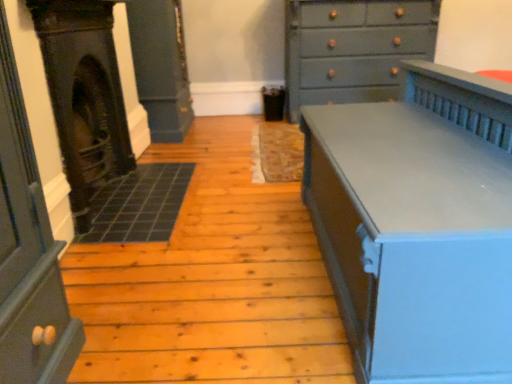
Question: Can you confirm if dark gray stone fireplace at left is taller than matte gray chest of drawers at right, placed as the first chest of drawers when sorted from front to back?

Choices:
 (A) no
 (B) yes

Answer: (B)

Question: Considering the relative sizes of dark gray stone fireplace at left and matte gray chest of drawers at right, which ranks as the 2th chest of drawers in back-to-front order, in the image provided, is dark gray stone fireplace at left bigger than matte gray chest of drawers at right, which ranks as the 2th chest of drawers in back-to-front order,?

Choices:
 (A) yes
 (B) no

Answer: (B)

Question: Is dark gray stone fireplace at left smaller than matte gray chest of drawers at right, placed as the 1th chest of drawers when sorted from bottom to top?

Choices:
 (A) no
 (B) yes

Answer: (B)

Question: Could you tell me if dark gray stone fireplace at left is facing matte gray chest of drawers at right, which ranks as the 2th chest of drawers in back-to-front order?

Choices:
 (A) no
 (B) yes

Answer: (B)

Question: From a real-world perspective, does dark gray stone fireplace at left sit lower than matte gray chest of drawers at right, placed as the 1th chest of drawers when sorted from bottom to top?

Choices:
 (A) no
 (B) yes

Answer: (A)

Question: Can you confirm if dark gray stone fireplace at left is positioned to the left of matte gray chest of drawers at right, which ranks as the 2th chest of drawers in back-to-front order?

Choices:
 (A) no
 (B) yes

Answer: (B)

Question: Can you confirm if dark gray stone fireplace at left is wider than matte gray chest of drawers at upper right, which ranks as the first chest of drawers in back-to-front order?

Choices:
 (A) yes
 (B) no

Answer: (B)

Question: Is dark gray stone fireplace at left positioned behind matte gray chest of drawers at upper right, positioned as the 2th chest of drawers in bottom-to-top order?

Choices:
 (A) no
 (B) yes

Answer: (A)

Question: Is dark gray stone fireplace at left not close to matte gray chest of drawers at upper right, which is counted as the 2th chest of drawers, starting from the front?

Choices:
 (A) no
 (B) yes

Answer: (B)

Question: Does dark gray stone fireplace at left have a lesser height compared to matte gray chest of drawers at upper right, which is counted as the 2th chest of drawers, starting from the front?

Choices:
 (A) yes
 (B) no

Answer: (A)

Question: Considering the relative sizes of dark gray stone fireplace at left and matte gray chest of drawers at upper right, positioned as the 2th chest of drawers in bottom-to-top order, in the image provided, is dark gray stone fireplace at left thinner than matte gray chest of drawers at upper right, positioned as the 2th chest of drawers in bottom-to-top order,?

Choices:
 (A) yes
 (B) no

Answer: (A)

Question: From a real-world perspective, is dark gray stone fireplace at left under matte gray chest of drawers at upper right, which is counted as the 2th chest of drawers, starting from the front?

Choices:
 (A) no
 (B) yes

Answer: (B)

Question: Is dark gray stone fireplace at left inside matte gray chest of drawers at upper right, which ranks as the first chest of drawers in back-to-front order?

Choices:
 (A) yes
 (B) no

Answer: (B)